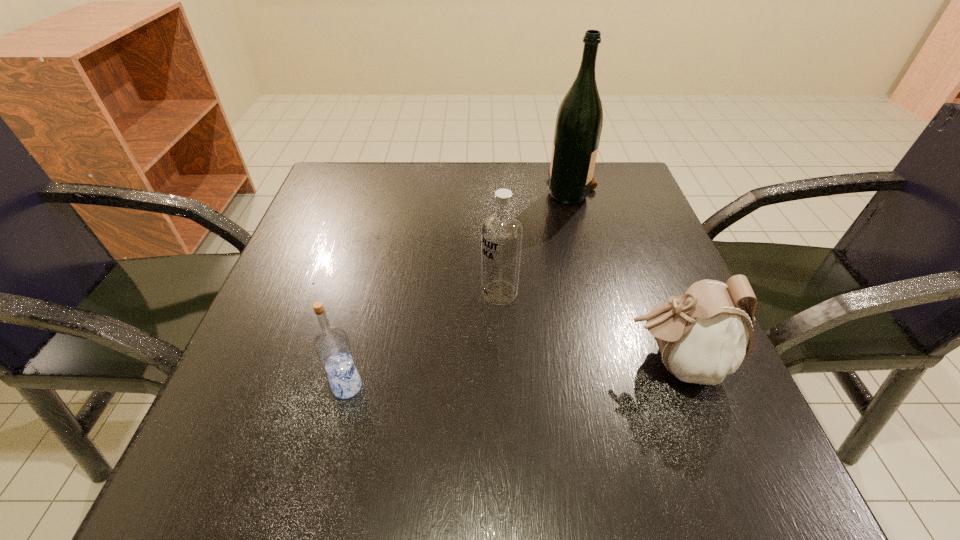
Image resolution: width=960 pixels, height=540 pixels. In order to click on vacant space located on the front label of the taller vodka in this screenshot , I will do 309,293.

What are the coordinates of `vacant space positioned 0.330m on the back of the left vodka` in the screenshot? It's located at (384, 238).

Identify the location of vacant space located 0.260m on the front-facing side of the pouch. This screenshot has height=540, width=960. (457, 363).

This screenshot has width=960, height=540. Find the location of `free region located 0.370m on the front-facing side of the pouch`. free region located 0.370m on the front-facing side of the pouch is located at coordinates (387, 363).

Where is `vacant space located on the front-facing side of the pouch`? The height and width of the screenshot is (540, 960). vacant space located on the front-facing side of the pouch is located at coordinates (373, 363).

At what (x,y) coordinates should I click in order to perform the action: click on object that is at the far edge. Please return your answer as a coordinate pair (x, y). The height and width of the screenshot is (540, 960). Looking at the image, I should click on [579, 121].

Image resolution: width=960 pixels, height=540 pixels. What are the coordinates of `object positioned at the left edge` in the screenshot? It's located at (331, 344).

You are a GUI agent. You are given a task and a screenshot of the screen. Output one action in this format:
    pyautogui.click(x=<x>, y=<y>)
    Task: Click on the wine bottle located in the right edge section of the desktop
    The image size is (960, 540).
    Given the screenshot: What is the action you would take?
    pyautogui.click(x=579, y=121)

Locate an element on the screen. This screenshot has height=540, width=960. pouch located in the right edge section of the desktop is located at coordinates (707, 333).

What are the coordinates of `object present at the far right corner` in the screenshot? It's located at (579, 121).